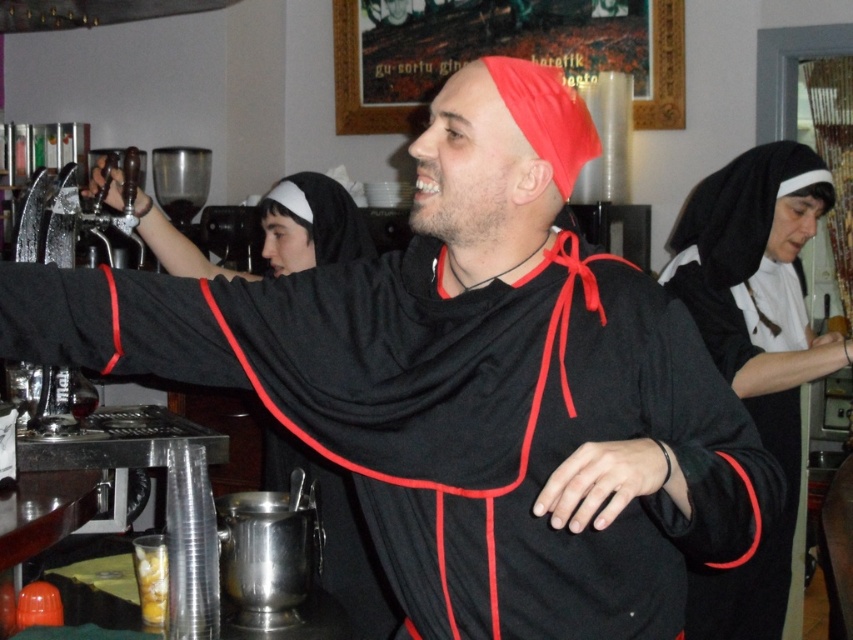
Looking at this image, you are a customer at the bar and want to order a drink. The bartender is wearing a black velvet habit at upper right. Where should you look to catch their attention?

The black velvet habit at upper right is located at coordinates point (756, 353), so you should look towards that position to catch their attention.

You are a customer at the bar and want to order a drink from the bartender wearing the black velvet habit at upper right. However, there is a translucent plastic cup at lower left in your way. Can you reach the bartender without moving the cup?

The black velvet habit at upper right is to the right of the translucent plastic cup at lower left, so you can reach the bartender wearing the black velvet habit at upper right by moving around to the right side of the translucent plastic cup at lower left without disturbing it.

You are a customer at the bar and want to order a drink. You notice the black velvet habit at upper right and the translucent plastic cup at lower left. Which object is larger and would be more suitable for holding a drink?

The black velvet habit at upper right is bigger than the translucent plastic cup at lower left, so the black velvet habit at upper right would be more suitable for holding a drink.